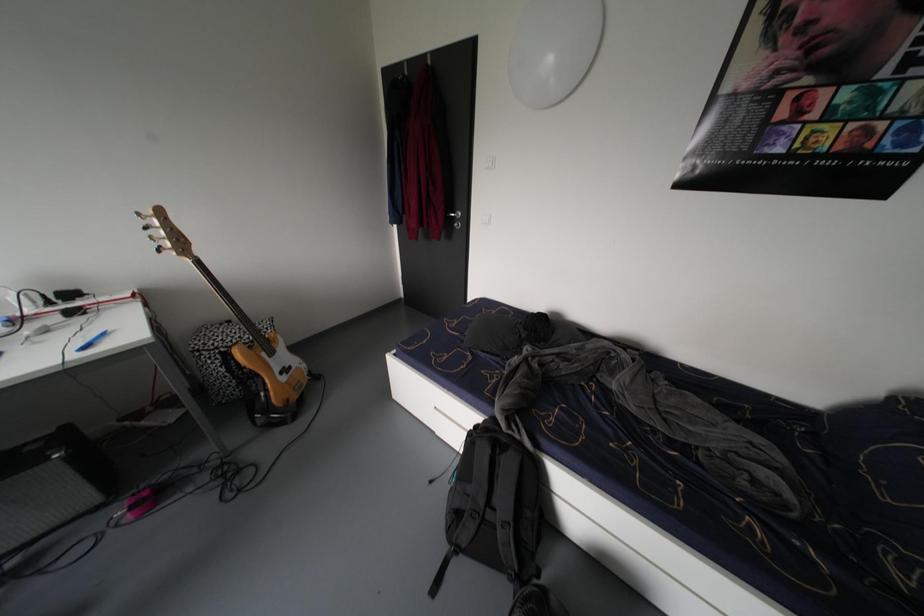
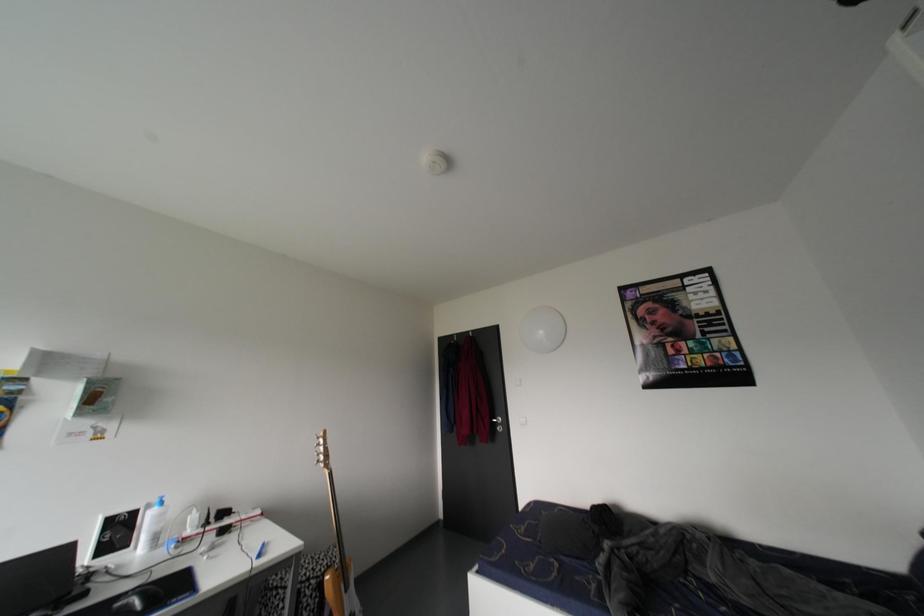
Question: How did the camera likely rotate?

Choices:
 (A) Left
 (B) Right
 (C) Up
 (D) Down

Answer: (C)